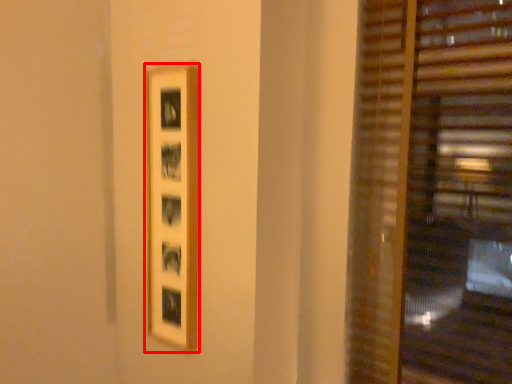
Question: From the image, what is the correct spatial relationship of picture frame (annotated by the red box) in relation to window blind?

Choices:
 (A) right
 (B) left

Answer: (B)